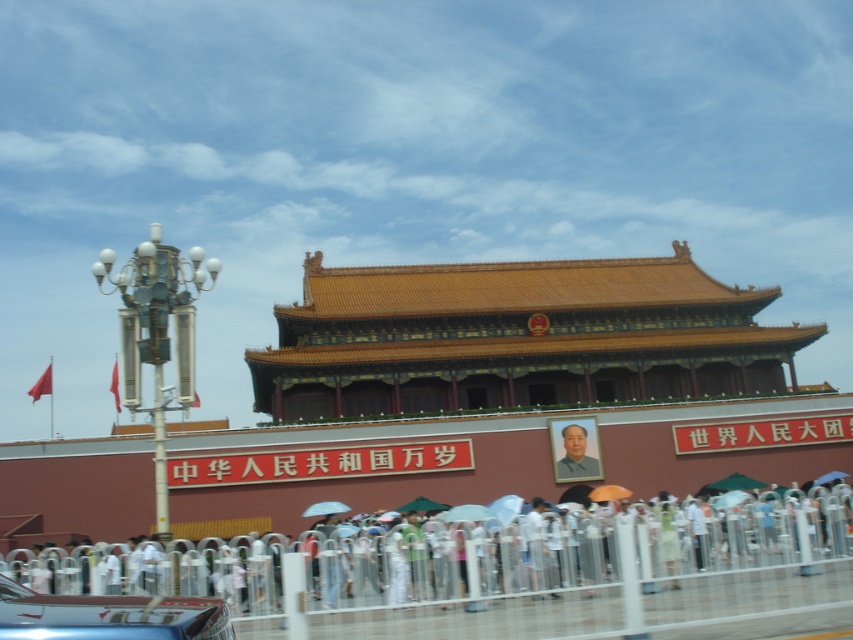
Question: Which of the following is the farthest from the observer?

Choices:
 (A) smooth gray portrait at center
 (B) metallic blue car at lower left
 (C) brown/golden/stone palace at center

Answer: (A)

Question: Can you confirm if golden glazed tile roof at center is thinner than smooth gray portrait at center?

Choices:
 (A) yes
 (B) no

Answer: (B)

Question: Can you confirm if brown/golden/stone palace at center is smaller than smooth gray portrait at center?

Choices:
 (A) no
 (B) yes

Answer: (A)

Question: Which object is farther from the camera taking this photo?

Choices:
 (A) white metal fence at lower center
 (B) smooth gray portrait at center
 (C) golden glazed tile roof at center
 (D) brown/golden/stone palace at center

Answer: (C)

Question: Which object is the closest to the white metal fence at lower center?

Choices:
 (A) brown/golden/stone palace at center
 (B) metallic blue car at lower left

Answer: (B)

Question: Is white metal fence at lower center positioned before golden glazed tile roof at center?

Choices:
 (A) no
 (B) yes

Answer: (B)